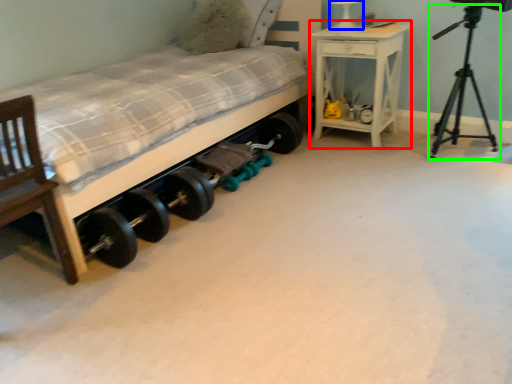
Question: Considering the real-world distances, which object is closest to nightstand (highlighted by a red box)? table lamp (highlighted by a blue box) or tripod (highlighted by a green box).

Choices:
 (A) table lamp
 (B) tripod

Answer: (A)